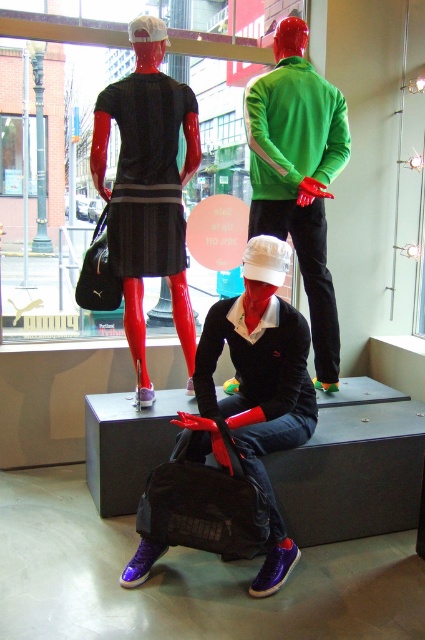
You are a delivery person who needs to place a 3.5 meter long ladder between the matte black dress at upper left and the matte black duffel bag at center. Can you fit the ladder between them without bending it?

The distance between the matte black dress at upper left and the matte black duffel bag at center is 3.61 meters, so the 3.5 meter ladder can fit between them without bending.

You are a tailor measuring the distance between the matte green jacket at upper center and the matte black dress at center for a fitting. Can a 50 cm long measuring tape reach both ends?

The distance between the matte green jacket at upper center and the matte black dress at center is 51.17 centimeters, so a 50 cm measuring tape cannot fully reach both ends as it is shorter than the required distance.